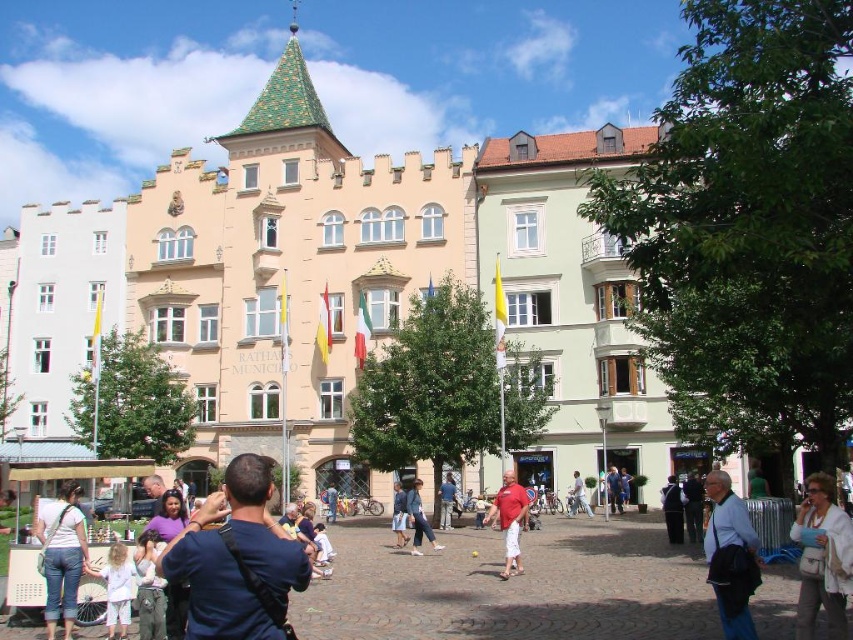
You are a fashion designer observing the crowd in front of the building. You notice two jackets displayed on mannequins. The black leather jacket at lower right and the denim jacket at center. Which jacket appears shorter in height?

The black leather jacket at lower right has a lesser height compared to the denim jacket at center, so the black leather jacket at lower right appears shorter.

You are a photographer standing in the plaza and want to take a photo of the building. You notice a black leather jacket at lower right and a denim jacket at center in your shot. Which jacket is closer to you, the photographer?

The black leather jacket at lower right is closer to you because it is in front of the denim jacket at center in the image.